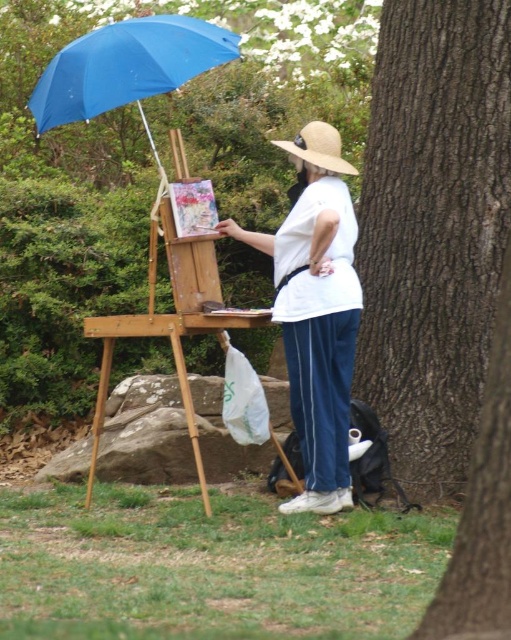
Who is more distant from viewer, (454, 68) or (321, 243)?

Positioned behind is point (454, 68).

Which of these two, brown rough bark tree at right or white cotton shirt at center, stands taller?

brown rough bark tree at right

Between point (410, 102) and point (306, 401), which one is positioned behind?

The point (410, 102) is behind.

The height and width of the screenshot is (640, 511). In order to click on brown rough bark tree at right in this screenshot , I will do `click(432, 228)`.

How distant is brown rough bark tree at right from straw hat at upper center?

The distance of brown rough bark tree at right from straw hat at upper center is 96.73 centimeters.

Can you confirm if brown rough bark tree at right is positioned above straw hat at upper center?

Incorrect, brown rough bark tree at right is not positioned above straw hat at upper center.

Is point (491, 141) closer to viewer compared to point (340, 172)?

No, (491, 141) is further to viewer.

At what (x,y) coordinates should I click in order to perform the action: click on brown rough bark tree at right. Please return your answer as a coordinate pair (x, y). This screenshot has height=640, width=511. Looking at the image, I should click on (432, 228).

Who is positioned more to the left, white cotton shirt at center or wooden easel at center?

From the viewer's perspective, wooden easel at center appears more on the left side.

At what (x,y) coordinates should I click in order to perform the action: click on white cotton shirt at center. Please return your answer as a coordinate pair (x, y). The width and height of the screenshot is (511, 640). Looking at the image, I should click on (315, 310).